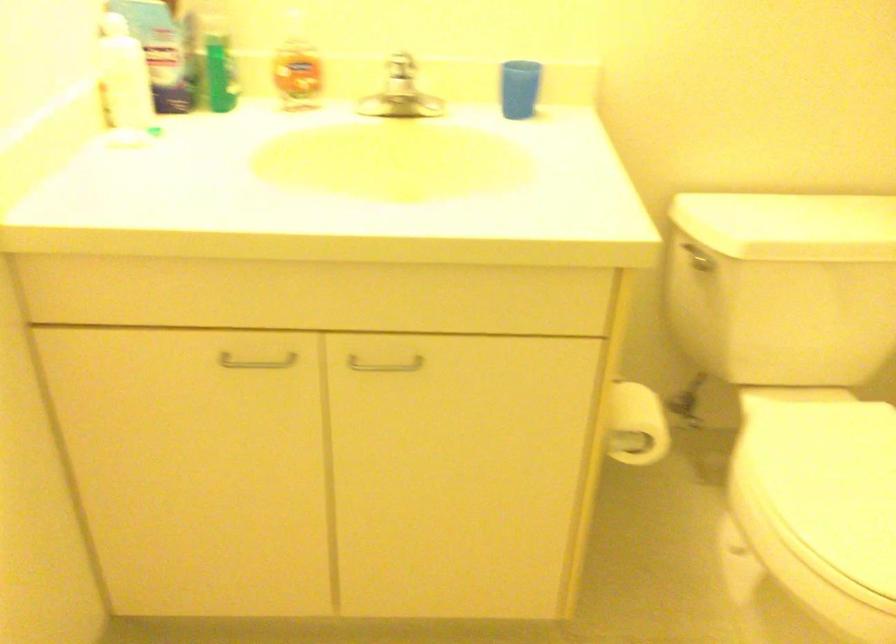
Find where to pull the toilet paper roll. Please return your answer as a coordinate pair (x, y).

(635, 424)